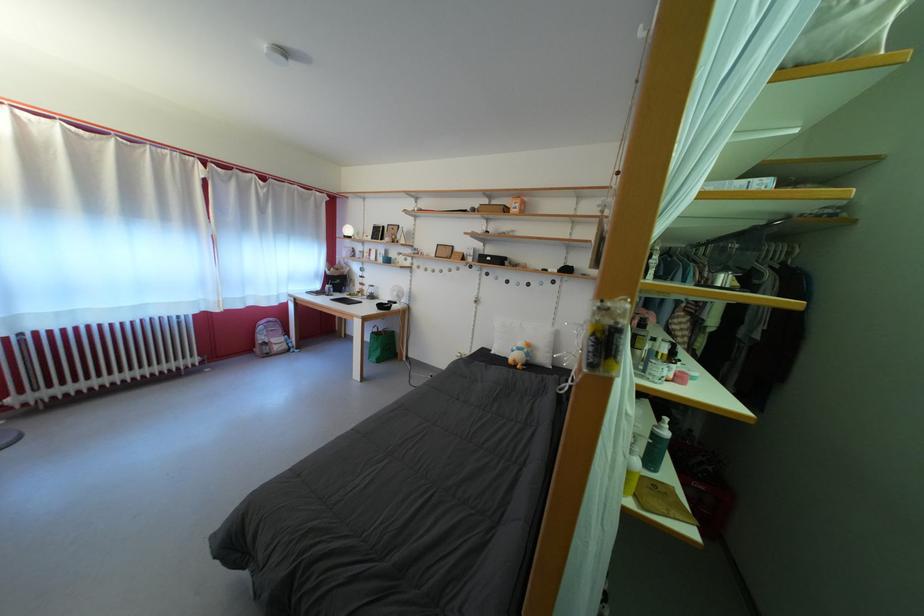
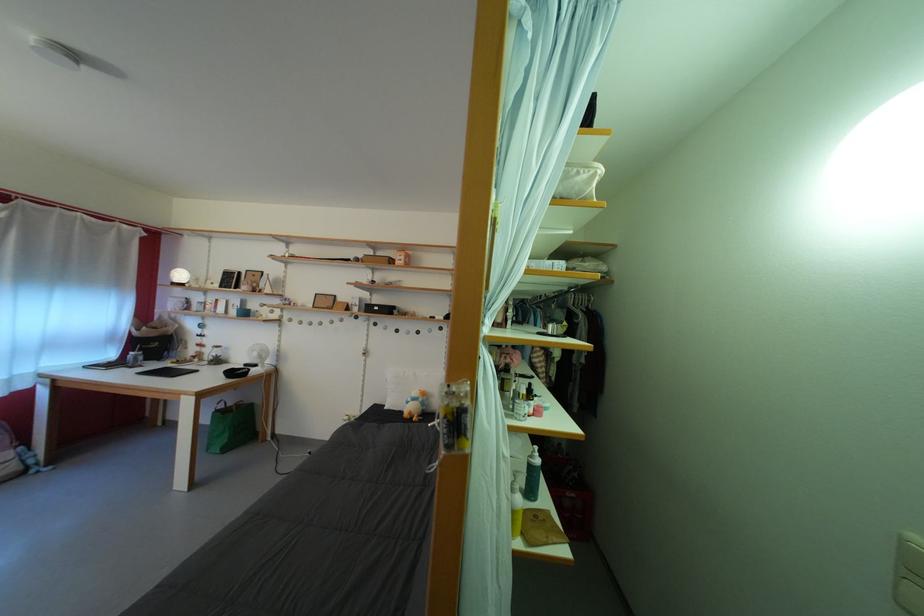
Where in the second image is the point corresponding to (x=404, y=300) from the first image?

(263, 360)